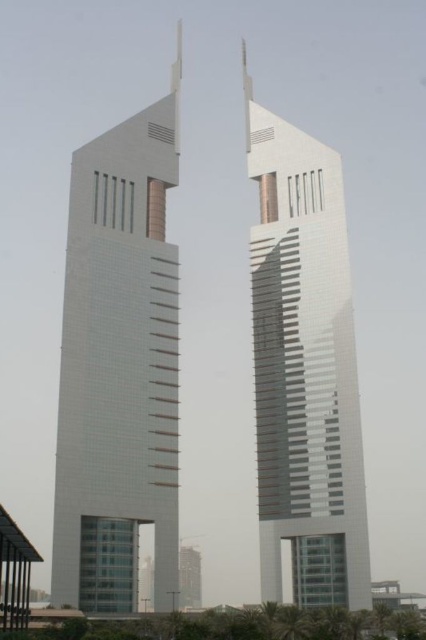
You are an architect reviewing a cityscape design. You notice two towers, the white glass tower at center and the shiny glass tower at center. Based on their positions in the image, which tower would cast a shadow over the other during midday when the sun is directly overhead?

The white glass tower at center is above the shiny glass tower at center, so it would cast a shadow over the shiny glass tower at center during midday when the sun is directly overhead.